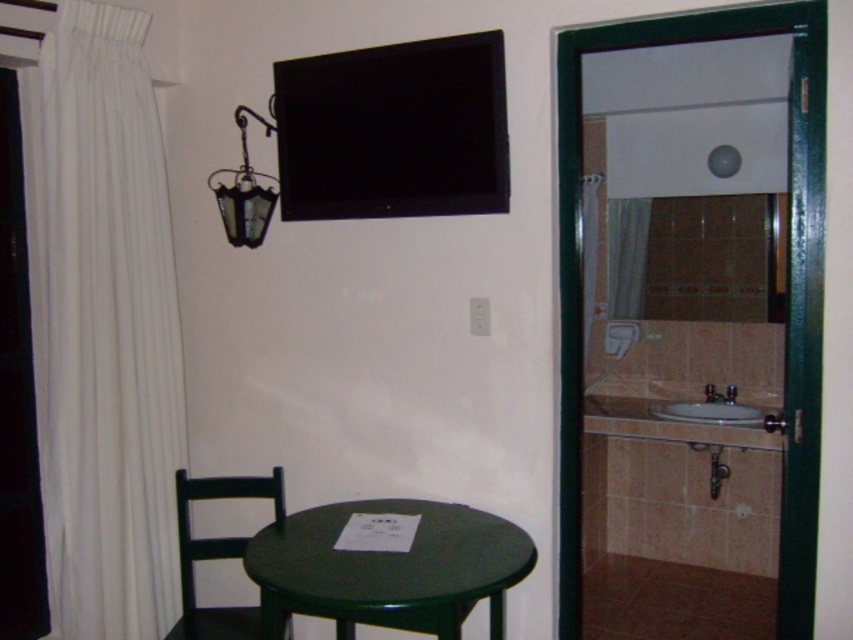
Is point (286, 589) closer to camera compared to point (738, 424)?

Yes.

The image size is (853, 640). Find the location of `green glossy table at lower center`. green glossy table at lower center is located at coordinates (387, 570).

Describe the element at coordinates (387, 570) in the screenshot. I see `green glossy table at lower center` at that location.

At what (x,y) coordinates should I click in order to perform the action: click on green glossy table at lower center. Please return your answer as a coordinate pair (x, y). This screenshot has height=640, width=853. Looking at the image, I should click on (387, 570).

Who is higher up, black glossy flat at upper center or green glossy table at lower center?

black glossy flat at upper center

Which is in front, point (442, 104) or point (280, 548)?

Point (280, 548)

Find the location of `black glossy flat at upper center`. black glossy flat at upper center is located at coordinates (393, 131).

Does black glossy flat at upper center appear on the left side of black matte chair at lower left?

No, black glossy flat at upper center is not to the left of black matte chair at lower left.

Does black glossy flat at upper center have a lesser width compared to black matte chair at lower left?

No, black glossy flat at upper center is not thinner than black matte chair at lower left.

Identify the location of black glossy flat at upper center. (393, 131).